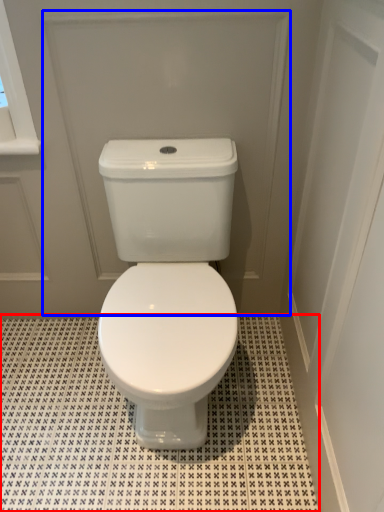
Question: Which object is further to the camera taking this photo, tile (highlighted by a red box) or screen door (highlighted by a blue box)?

Choices:
 (A) tile
 (B) screen door

Answer: (A)